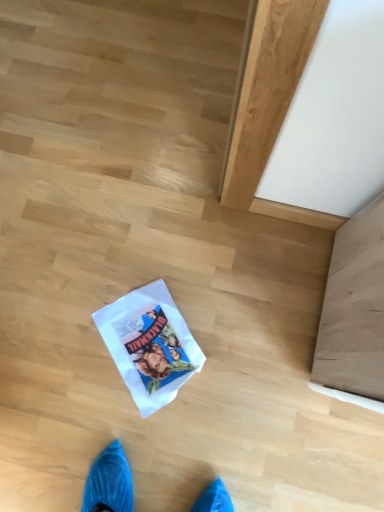
Question: Should I look upward or downward to see white paper comic book at center?

Choices:
 (A) down
 (B) up

Answer: (A)